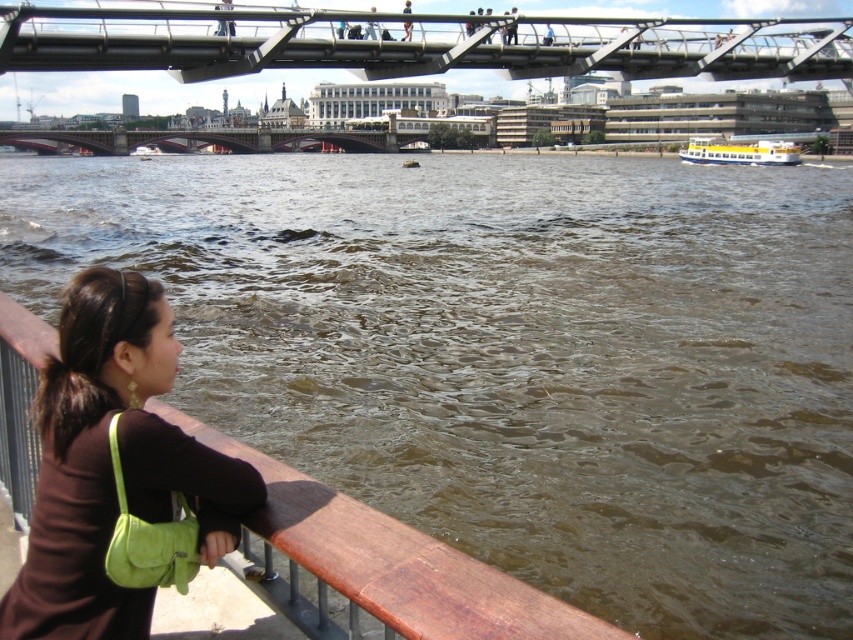
Which is in front, point (704, 74) or point (184, 577)?

Point (184, 577) is more forward.

What do you see at coordinates (416, 44) in the screenshot?
I see `metallic gray bridge at upper center` at bounding box center [416, 44].

Does point (277, 45) come farther from viewer compared to point (135, 541)?

Yes, point (277, 45) is farther from viewer.

I want to click on metallic gray bridge at upper center, so click(x=416, y=44).

Who is lower down, dark red stone bridge at center or yellow matte boat at right?

yellow matte boat at right

Is point (180, 145) more distant than point (778, 163)?

Yes, it is behind point (778, 163).

Identify the location of dark red stone bridge at center. This screenshot has height=640, width=853. (204, 140).

Who is positioned more to the right, brown suede purse at lower left or yellow matte boat at right?

From the viewer's perspective, yellow matte boat at right appears more on the right side.

Can you confirm if brown suede purse at lower left is positioned to the right of yellow matte boat at right?

No, brown suede purse at lower left is not to the right of yellow matte boat at right.

Describe the element at coordinates (111, 465) in the screenshot. The width and height of the screenshot is (853, 640). I see `brown suede purse at lower left` at that location.

Where is `brown suede purse at lower left`? brown suede purse at lower left is located at coordinates (111, 465).